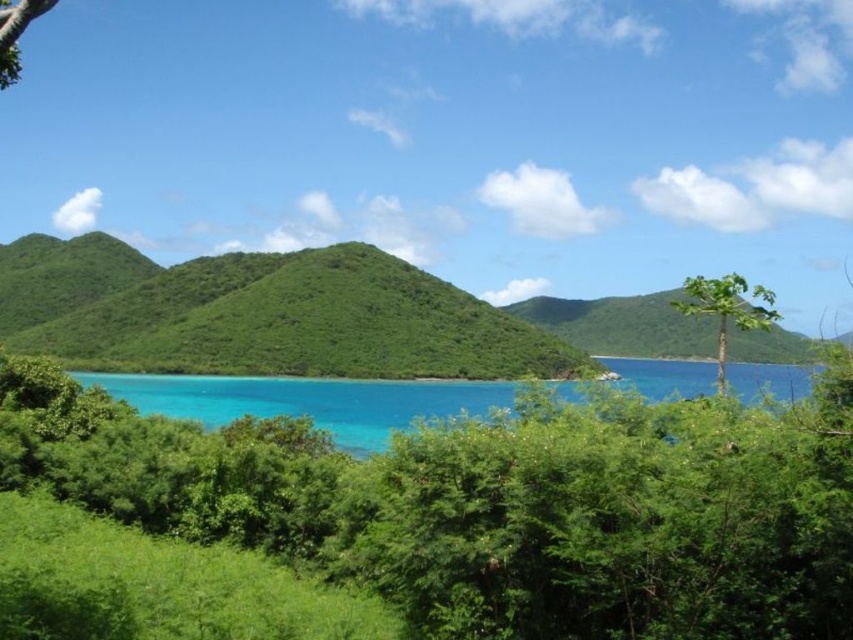
You are standing in the tropical landscape and want to walk towards both the green leafy hill at center and the green leafy tree at right. Which one will you reach first?

You will reach the green leafy hill at center first because it is closer to you than the green leafy tree at right, which is further away.

You are standing in the tropical landscape and want to take a photo of both the turquoise water at center and the green leafy tree at upper left. Which object should you position to the right side of your camera frame to include both in the shot?

You should position the turquoise water at center to the right side of your camera frame since it is already to the right of the green leafy tree at upper left.